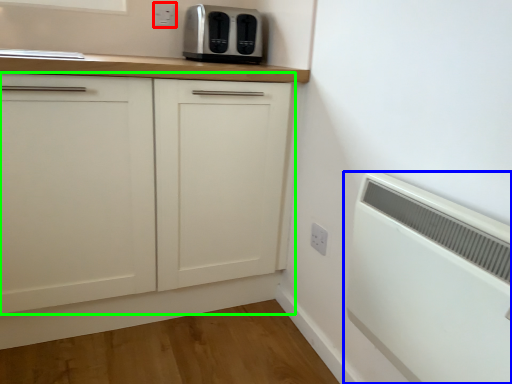
Question: Estimate the real-world distances between objects in this image. Which object is farther from electric outlet (highlighted by a red box), home appliance (highlighted by a blue box) or cabinetry (highlighted by a green box)?

Choices:
 (A) home appliance
 (B) cabinetry

Answer: (A)